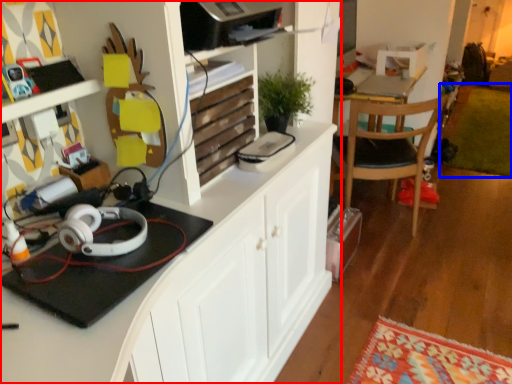
Question: Among these objects, which one is farthest to the camera, cabinetry (highlighted by a red box) or mat (highlighted by a blue box)?

Choices:
 (A) cabinetry
 (B) mat

Answer: (B)